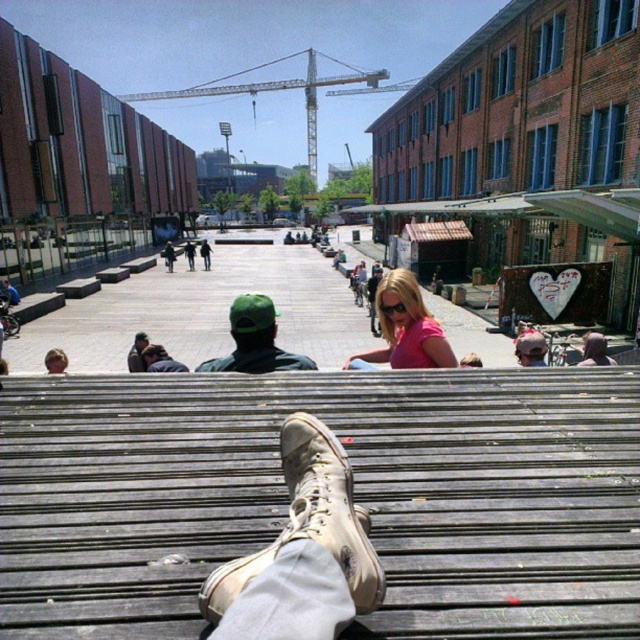
Question: Does pink matte shirt at center appear over matte black jacket at lower left?

Choices:
 (A) no
 (B) yes

Answer: (B)

Question: Which point is closer to the camera taking this photo?

Choices:
 (A) (60, 371)
 (B) (300, 528)

Answer: (B)

Question: Which point is closer to the camera taking this photo?

Choices:
 (A) (241, 314)
 (B) (60, 358)
 (C) (586, 364)

Answer: (A)

Question: Which of the following is the closest to the observer?

Choices:
 (A) (140, 600)
 (B) (417, 300)

Answer: (A)

Question: Considering the relative positions of pink matte shirt at center and matte black jacket at lower left in the image provided, where is pink matte shirt at center located with respect to matte black jacket at lower left?

Choices:
 (A) above
 (B) below

Answer: (A)

Question: Can you confirm if tan suede boot at center is bigger than matte black jacket at lower left?

Choices:
 (A) yes
 (B) no

Answer: (A)